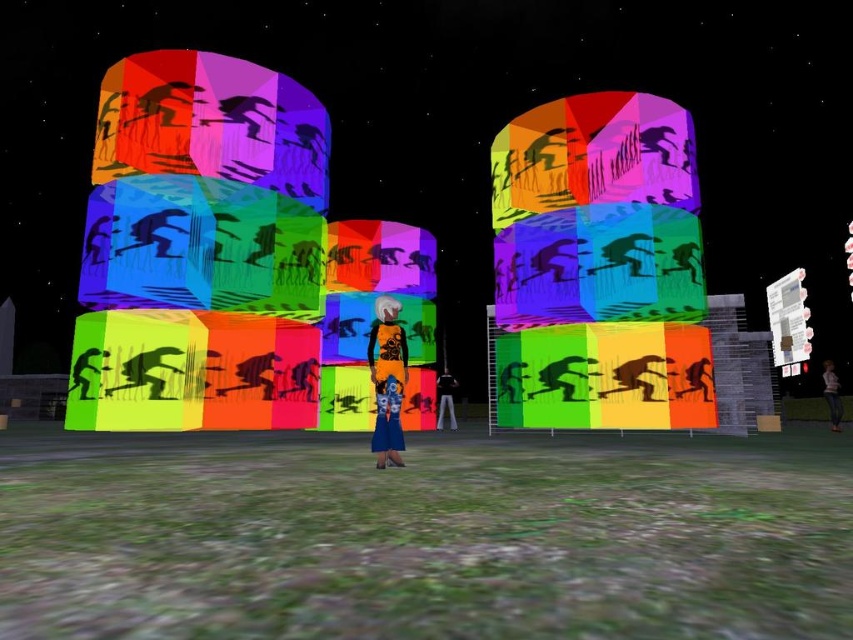
Does orange fabric dress at center have a smaller size compared to matte black pants at center?

Yes.

Which is above, orange fabric dress at center or matte black pants at center?

orange fabric dress at center

Is point (376, 384) farther from viewer compared to point (451, 392)?

No, (376, 384) is closer to viewer.

You are a GUI agent. You are given a task and a screenshot of the screen. Output one action in this format:
    pyautogui.click(x=<x>, y=<y>)
    Task: Click on the orange fabric dress at center
    
    Given the screenshot: What is the action you would take?
    pyautogui.click(x=387, y=380)

Is the position of orange fabric dress at center less distant than that of denim pants at center?

That is True.

Is point (376, 417) closer to camera compared to point (827, 396)?

That is True.

At what (x,y) coordinates should I click in order to perform the action: click on orange fabric dress at center. Please return your answer as a coordinate pair (x, y). Image resolution: width=853 pixels, height=640 pixels. Looking at the image, I should click on (387, 380).

What do you see at coordinates (445, 400) in the screenshot?
I see `matte black pants at center` at bounding box center [445, 400].

Can you confirm if matte black pants at center is positioned above denim pants at center?

No.

The image size is (853, 640). I want to click on matte black pants at center, so click(x=445, y=400).